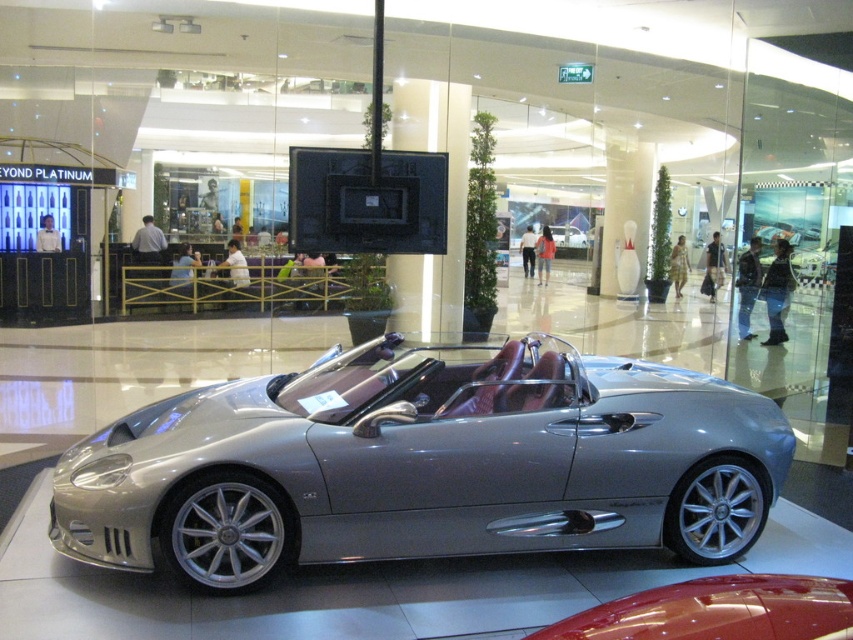
You are a photographer trying to capture both the silver metallic convertible at center and the glossy red car at lower right in a single frame. Based on their sizes, which car should you position closer to the camera to make them appear similar in size in the photo?

The silver metallic convertible at center is larger in size than the glossy red car at lower right, so to make them appear similar in size in the photo, you should position the smaller glossy red car at lower right closer to the camera while keeping the larger silver metallic convertible at center farther back.

You are standing in a shopping mall and see the silver metallic convertible at center. If you want to take a photo of it without any people in the frame, where should you position yourself relative to the car?

Since the silver metallic convertible at center is 12.46 feet away from the viewer, you should position yourself behind the car to avoid capturing people in the background, as the glass wall reflects the bustling indoor area with people walking and seated at tables.

You are a customer looking at the silver metallic convertible at center and the glossy red car at lower right in the showroom. Which car is placed higher up?

The silver metallic convertible at center is positioned over the glossy red car at lower right, so it is placed higher up.